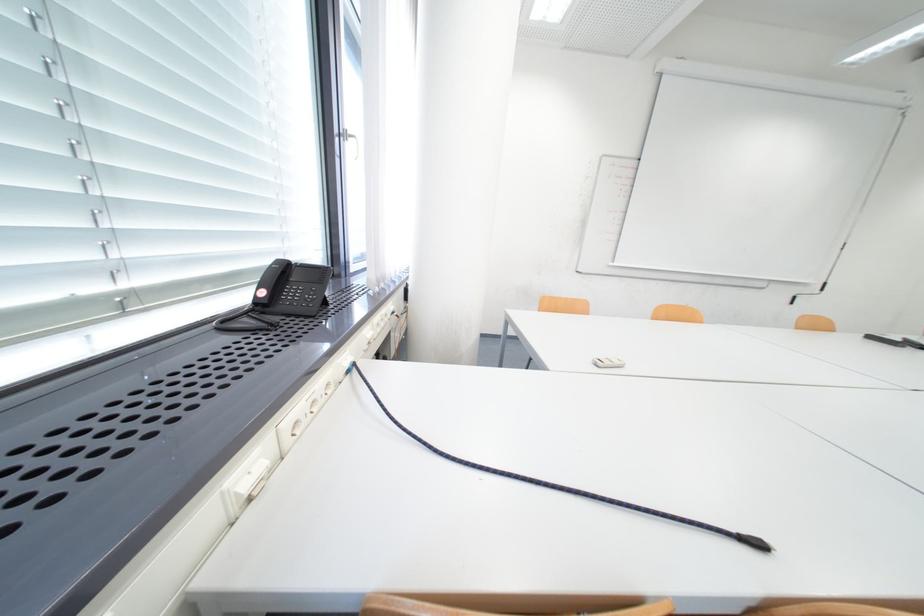
Find where to press the phone keypad button. Please return your answer as a coordinate pair (x, y).

(293, 294)